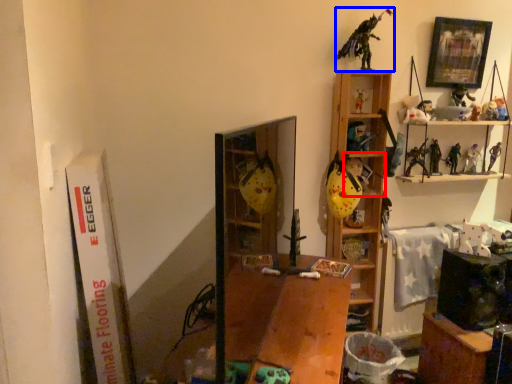
Question: Which object appears closest to the camera in this image, cabinet (highlighted by a red box) or toy (highlighted by a blue box)?

Choices:
 (A) cabinet
 (B) toy

Answer: (B)